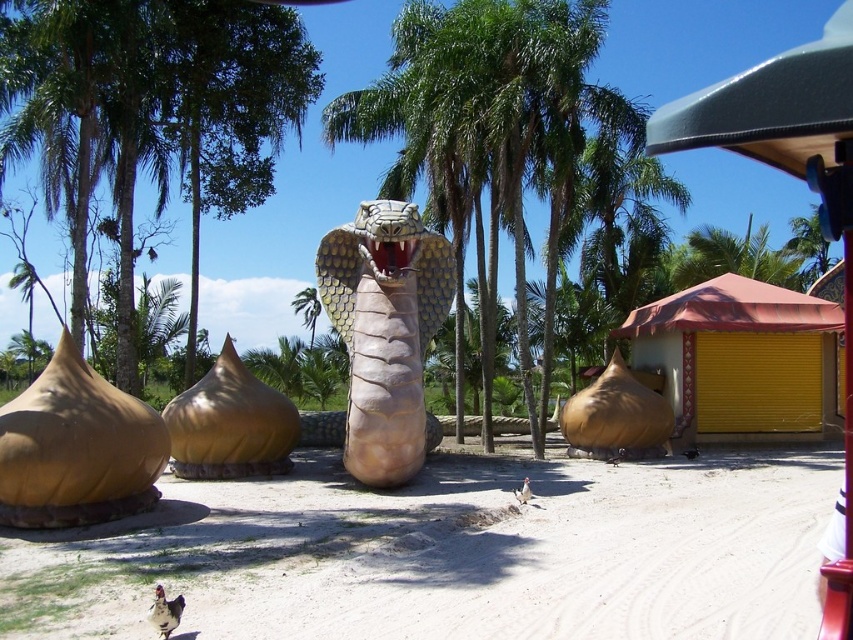
You are an artist planning to place a new sculpture between the matte gold dome at left and the matte gold dome at center. Based on their heights, which dome should the sculpture be placed closer to for visual balance?

The matte gold dome at left is shorter than the matte gold dome at center. To achieve visual balance, the sculpture should be placed closer to the taller matte gold dome at center to compensate for its greater height.

From the picture: You are standing in front of the cobra installation and want to place a small statue on the ground. The statue requires a space wider than the matte gold dome at center. Can the white sandy ground at center accommodate it?

The white sandy ground at center has a larger width than the matte gold dome at center, so it can accommodate the statue requiring a space wider than the matte gold dome at center.

You are standing at the point marked as point (x=457, y=557) in the image. What type of terrain are you currently standing on?

The point (x=457, y=557) is on white sandy ground at center, so you are standing on white sandy ground.